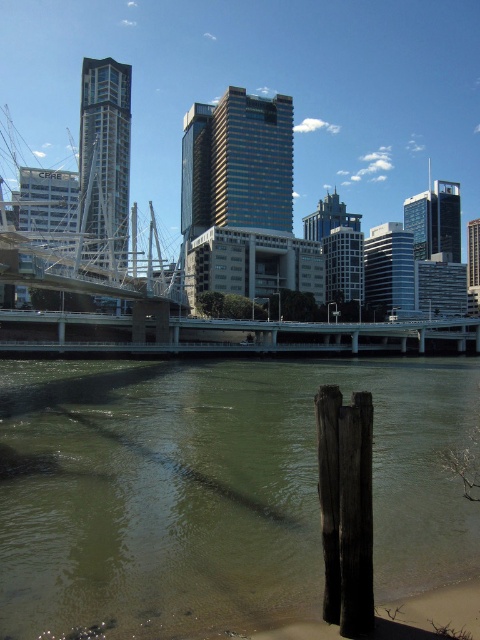
Is brown wood post at lower right shorter than concrete bridge at center?

Indeed, brown wood post at lower right has a lesser height compared to concrete bridge at center.

The width and height of the screenshot is (480, 640). What do you see at coordinates (214, 490) in the screenshot?
I see `brown wood post at lower right` at bounding box center [214, 490].

Who is more distant from viewer, (310, 458) or (179, 336)?

Point (179, 336)

Where is `brown wood post at lower right`? brown wood post at lower right is located at coordinates (214, 490).